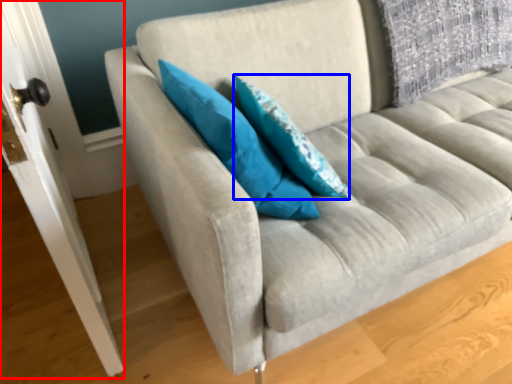
Question: Which object is closer to the camera taking this photo, door (highlighted by a red box) or pillow (highlighted by a blue box)?

Choices:
 (A) door
 (B) pillow

Answer: (A)